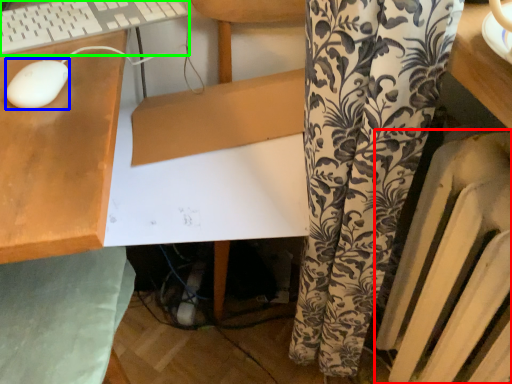
Question: Based on their relative distances, which object is nearer to radiator (highlighted by a red box)? Choose from mouse (highlighted by a blue box) and computer keyboard (highlighted by a green box).

Choices:
 (A) mouse
 (B) computer keyboard

Answer: (A)